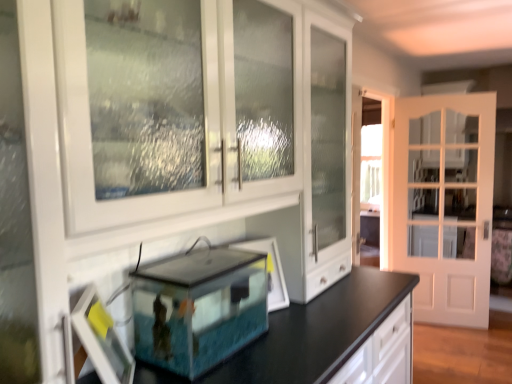
What do you see at coordinates (199, 308) in the screenshot? I see `transparent glass tank at center` at bounding box center [199, 308].

Describe the element at coordinates (269, 270) in the screenshot. I see `clear glass picture frame at center, arranged as the second picture frame when viewed from the front` at that location.

The height and width of the screenshot is (384, 512). What do you see at coordinates (102, 339) in the screenshot?
I see `matte white picture frame at lower left, the 1th picture frame viewed from the left` at bounding box center [102, 339].

Where is `white glass door at right`? This screenshot has height=384, width=512. white glass door at right is located at coordinates (445, 203).

Identify the location of the 2nd picture frame below the white glossy cabinet at center (from the image's perspective). (102, 339).

From a real-world perspective, is white glossy cabinet at center above or below matte white picture frame at lower left, the second picture frame in the back-to-front sequence?

From a real-world perspective, white glossy cabinet at center is physically above matte white picture frame at lower left, the second picture frame in the back-to-front sequence.

Can you confirm if white glossy cabinet at center is taller than matte white picture frame at lower left, the 1th picture frame viewed from the left?

Correct, white glossy cabinet at center is much taller as matte white picture frame at lower left, the 1th picture frame viewed from the left.

Is white glossy cabinet at center turned away from matte white picture frame at lower left, the 1th picture frame viewed from the left?

Yes, white glossy cabinet at center is facing away from matte white picture frame at lower left, the 1th picture frame viewed from the left.

There is a white glass door at right. Identify the location of the 2nd picture frame above it (from a real-world perspective). This screenshot has height=384, width=512. (102, 339).

Based on their positions, is matte white picture frame at lower left, positioned as the 2th picture frame in right-to-left order, located to the left or right of white glass door at right?

matte white picture frame at lower left, positioned as the 2th picture frame in right-to-left order, is positioned on white glass door at right's left side.

Who is bigger, matte white picture frame at lower left, the 1th picture frame from the front, or white glass door at right?

With larger size is white glass door at right.

Does clear glass picture frame at center, acting as the first picture frame starting from the right, have a lesser height compared to matte white picture frame at lower left, the 1th picture frame viewed from the left?

Correct, clear glass picture frame at center, acting as the first picture frame starting from the right, is not as tall as matte white picture frame at lower left, the 1th picture frame viewed from the left.

Is matte white picture frame at lower left, the second picture frame in the back-to-front sequence, at the back of clear glass picture frame at center, acting as the first picture frame starting from the right?

No.

From the image's perspective, is clear glass picture frame at center, acting as the first picture frame starting from the right, over matte white picture frame at lower left, the second picture frame in the back-to-front sequence?

Correct, clear glass picture frame at center, acting as the first picture frame starting from the right, appears higher than matte white picture frame at lower left, the second picture frame in the back-to-front sequence, in the image.

Are clear glass picture frame at center, arranged as the second picture frame when viewed from the front, and matte white picture frame at lower left, the second picture frame in the back-to-front sequence, far apart?

clear glass picture frame at center, arranged as the second picture frame when viewed from the front, is actually quite close to matte white picture frame at lower left, the second picture frame in the back-to-front sequence.

Between point (275, 309) and point (455, 204), which one is positioned behind?

The point (455, 204) is farther from the camera.

Would you say white glass door at right is part of clear glass picture frame at center, positioned as the 2th picture frame in left-to-right order,'s contents?

No, white glass door at right is located outside of clear glass picture frame at center, positioned as the 2th picture frame in left-to-right order.

I want to click on the 1st picture frame positioned above the white glass door at right (from a real-world perspective), so click(269, 270).

Can you tell me how much clear glass picture frame at center, positioned as the 2th picture frame in left-to-right order, and white glass door at right differ in facing direction?

There is a 51-degree angle between the facing directions of clear glass picture frame at center, positioned as the 2th picture frame in left-to-right order, and white glass door at right.

Is transparent glass tank at center at the back of matte white picture frame at lower left, the 1th picture frame from the front?

No, matte white picture frame at lower left, the 1th picture frame from the front, is not facing away from transparent glass tank at center.

Are matte white picture frame at lower left, positioned as the 2th picture frame in right-to-left order, and transparent glass tank at center beside each other?

No.

Is matte white picture frame at lower left, the 1th picture frame viewed from the left, wider than transparent glass tank at center?

In fact, matte white picture frame at lower left, the 1th picture frame viewed from the left, might be narrower than transparent glass tank at center.

Who is shorter, matte white picture frame at lower left, positioned as the 2th picture frame in right-to-left order, or transparent glass tank at center?

transparent glass tank at center.

From the picture: Is transparent glass tank at center at the back of white glossy cabinet at center?

Yes, white glossy cabinet at center's orientation is away from transparent glass tank at center.

Considering the sizes of objects white glossy cabinet at center and transparent glass tank at center in the image provided, who is bigger, white glossy cabinet at center or transparent glass tank at center?

white glossy cabinet at center is bigger.

In the image, is white glossy cabinet at center positioned in front of or behind transparent glass tank at center?

white glossy cabinet at center is in front of transparent glass tank at center.

Which of these two, transparent glass tank at center or clear glass picture frame at center, acting as the first picture frame starting from the right, stands taller?

transparent glass tank at center.

Is transparent glass tank at center bigger than clear glass picture frame at center, acting as the first picture frame starting from the right?

Yes.

Which of these two, transparent glass tank at center or clear glass picture frame at center, arranged as the second picture frame when viewed from the front, is wider?

With larger width is transparent glass tank at center.

Is transparent glass tank at center next to clear glass picture frame at center, the 1th picture frame from the back, and touching it?

No, transparent glass tank at center is not touching clear glass picture frame at center, the 1th picture frame from the back.

I want to click on cabinetry above the matte white picture frame at lower left, the 1th picture frame from the front (from the image's perspective), so click(167, 144).

You are a GUI agent. You are given a task and a screenshot of the screen. Output one action in this format:
    pyautogui.click(x=<x>, y=<y>)
    Task: Click on the door behind the matte white picture frame at lower left, the 1th picture frame from the front
    
    Given the screenshot: What is the action you would take?
    pyautogui.click(x=445, y=203)

Which object lies further to the anchor point clear glass picture frame at center, arranged as the second picture frame when viewed from the front, matte white picture frame at lower left, positioned as the 2th picture frame in right-to-left order, or white glass door at right?

Based on the image, white glass door at right appears to be further to clear glass picture frame at center, arranged as the second picture frame when viewed from the front.

Estimate the real-world distances between objects in this image. Which object is closer to white glossy cabinet at center, clear glass picture frame at center, positioned as the 2th picture frame in left-to-right order, or transparent glass tank at center?

transparent glass tank at center is positioned closer to the anchor white glossy cabinet at center.

Considering their positions, is white glass door at right positioned further to transparent glass tank at center than matte white picture frame at lower left, the second picture frame in the back-to-front sequence?

Among the two, white glass door at right is located further to transparent glass tank at center.

Looking at this image, based on their spatial positions, is matte white picture frame at lower left, positioned as the 2th picture frame in right-to-left order, or white glossy cabinet at center closer to transparent glass tank at center?

matte white picture frame at lower left, positioned as the 2th picture frame in right-to-left order, is positioned closer to the anchor transparent glass tank at center.

Looking at the image, which one is located closer to matte white picture frame at lower left, positioned as the 2th picture frame in right-to-left order, clear glass picture frame at center, arranged as the second picture frame when viewed from the front, or white glossy cabinet at center?

white glossy cabinet at center is positioned closer to the anchor matte white picture frame at lower left, positioned as the 2th picture frame in right-to-left order.

Based on the photo, estimate the real-world distances between objects in this image. Which object is further from matte white picture frame at lower left, the 1th picture frame from the front, white glass door at right or transparent glass tank at center?

The object further to matte white picture frame at lower left, the 1th picture frame from the front, is white glass door at right.

Looking at this image, which object lies further to the anchor point transparent glass tank at center, white glossy cabinet at center or matte white picture frame at lower left, the 1th picture frame from the front?

Among the two, white glossy cabinet at center is located further to transparent glass tank at center.

From the image, which object appears to be farther from transparent glass tank at center, white glass door at right or white glossy cabinet at center?

The object further to transparent glass tank at center is white glass door at right.

This screenshot has height=384, width=512. I want to click on picture frame between matte white picture frame at lower left, the second picture frame in the back-to-front sequence, and white glass door at right from front to back, so click(269, 270).

Identify the location of glass box located between white glossy cabinet at center and white glass door at right in the depth direction. (199, 308).

Find the location of `picture frame between white glossy cabinet at center and clear glass picture frame at center, acting as the first picture frame starting from the right, in the front-back direction`. picture frame between white glossy cabinet at center and clear glass picture frame at center, acting as the first picture frame starting from the right, in the front-back direction is located at coordinates (102, 339).

Where is `picture frame between transparent glass tank at center and white glass door at right from front to back`? The width and height of the screenshot is (512, 384). picture frame between transparent glass tank at center and white glass door at right from front to back is located at coordinates (269, 270).